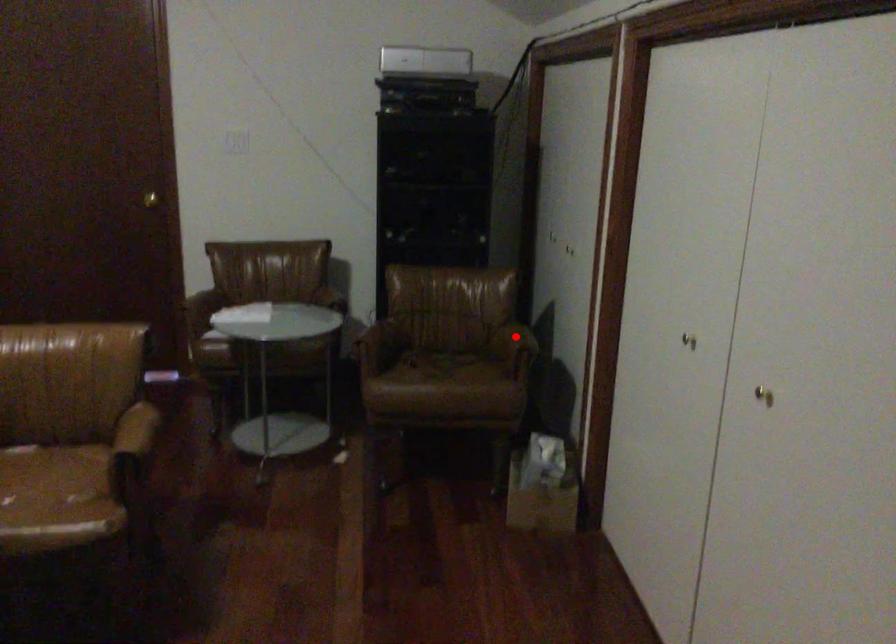
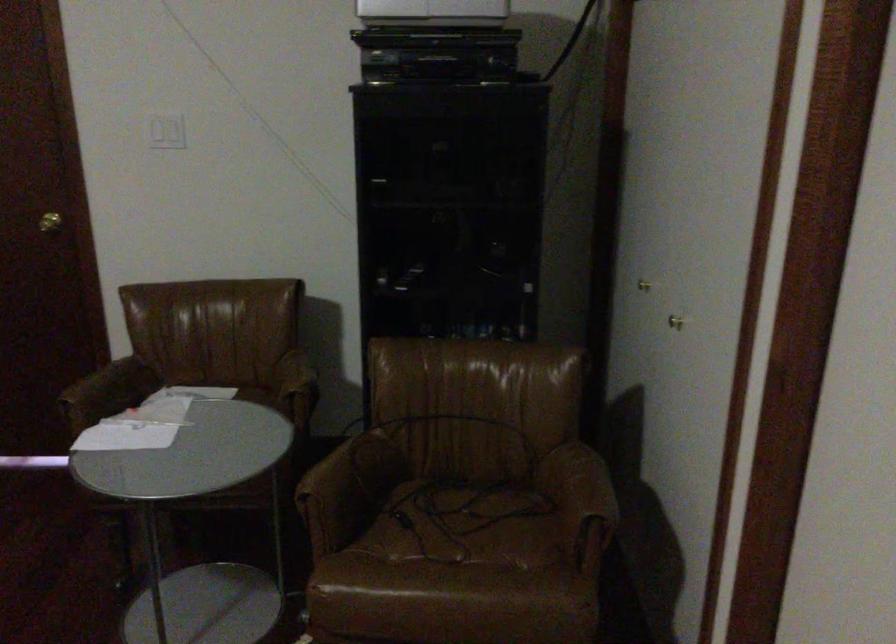
In the second image, find the point that corresponds to the highlighted location in the first image.

(582, 485)